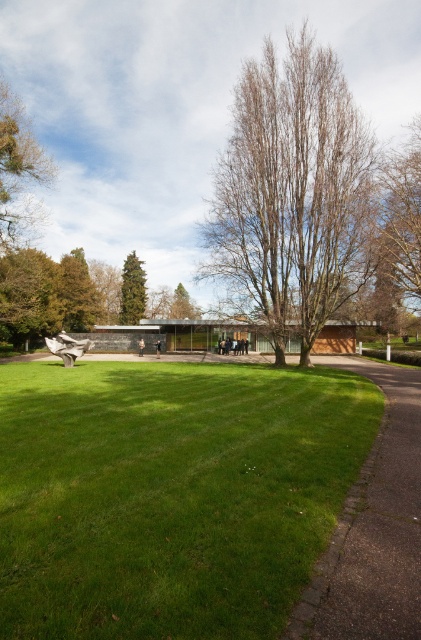
You are standing at the entrance of the modern building and want to walk to the paved stone path at lower right. However, there is a bare wood tree at center blocking your direct path. Can you walk around it to reach the path?

The bare wood tree at center is above the paved stone path at lower right, so the tree is located in front of the path. To reach the path, you can walk around the tree either to the left or right side to access the paved stone path at lower right.